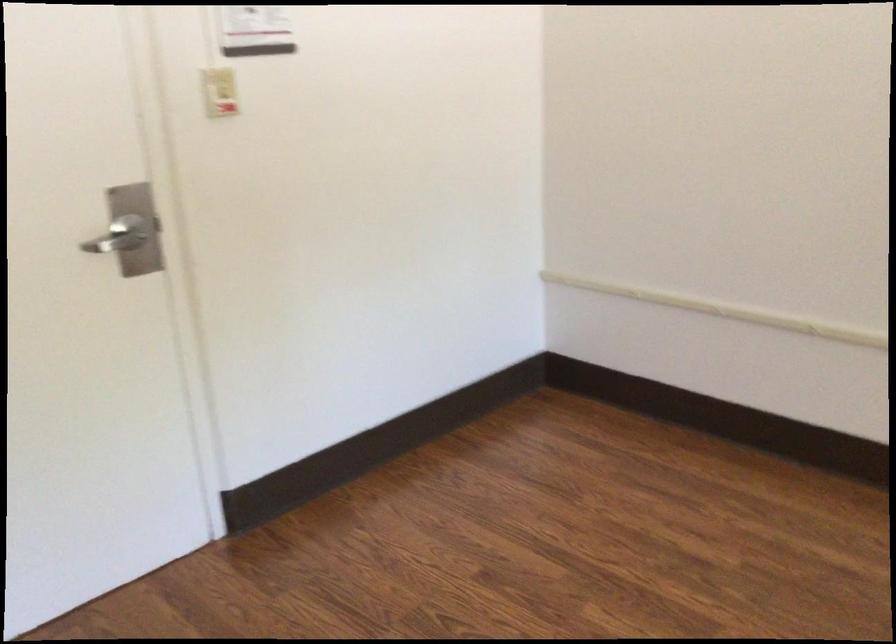
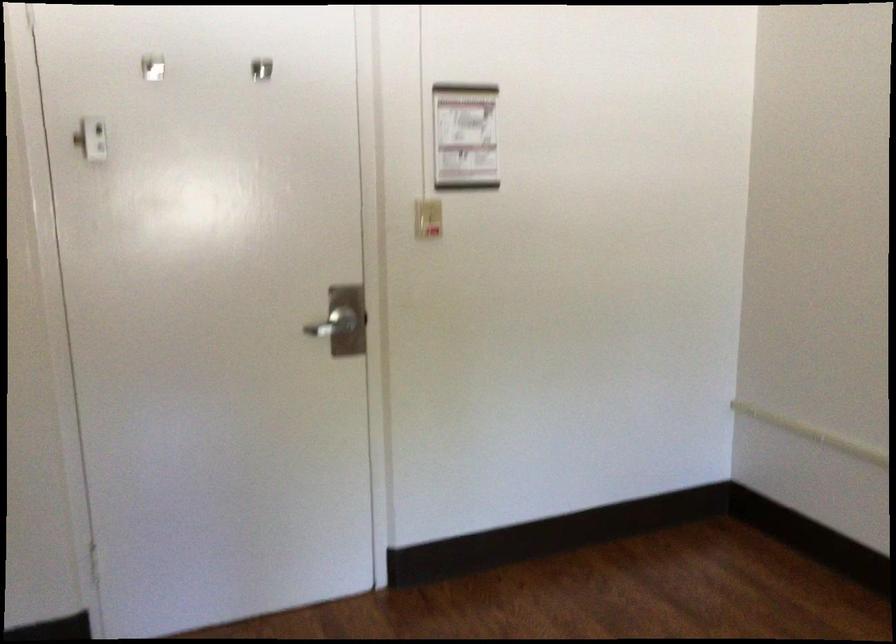
Find the pixel in the second image that matches point (213, 93) in the first image.

(427, 218)